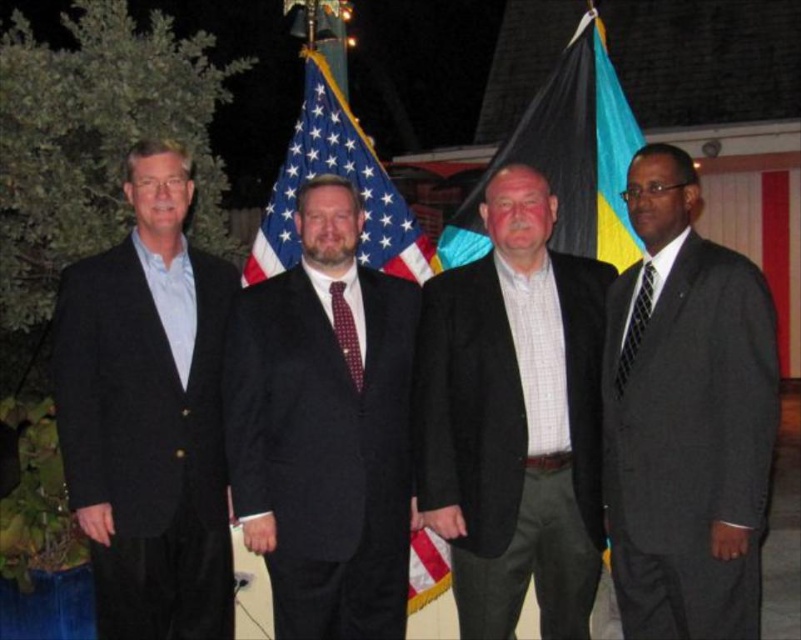
You are a photographer adjusting your camera settings. You want to capture a clear photo of both the matte black suit at left and the maroon textured tie at center. Considering their distance, what is the minimum distance your camera lens should focus on to ensure both are in focus?

The matte black suit at left is 37.24 inches away from the maroon textured tie at center. To ensure both are in focus, the camera lens should focus at the midpoint between them, which is approximately 18.62 inches from each object. However, since depth of field also depends on aperture and sensor size, using a smaller aperture or a higher fstop number would increase the depth of field, allowing both to be in focus even if focused on one of them.

You are a photographer trying to capture a group photo. You notice the checkered fabric shirt at center and the matte black suit at left. Based on their positions, which one is more likely to be in the frame if you zoom out slightly?

The checkered fabric shirt at center is more likely to be in the frame when zooming out because it is positioned centrally, while the matte black suit at left is on the edge and might be cut off.